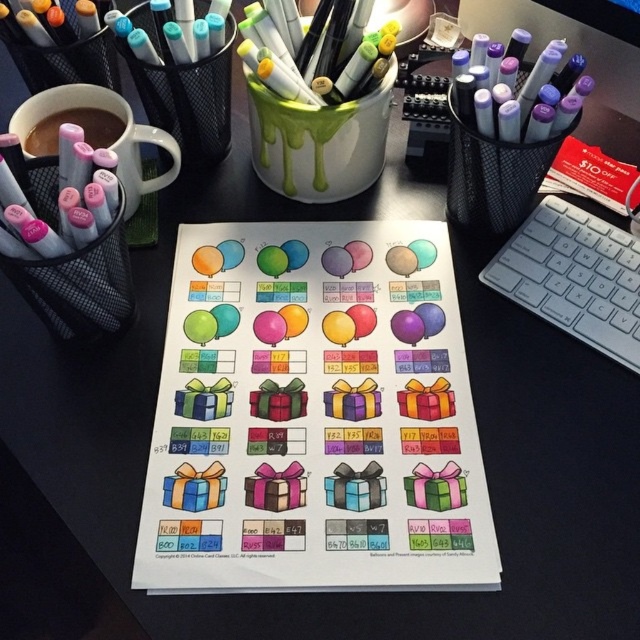
Question: Which object is the farthest from the purple matte marker at upper right?

Choices:
 (A) brown matte mug at upper left
 (B) white plastic keyboard at right
 (C) matte white mug at upper left

Answer: (A)

Question: Can you confirm if white plastic keyboard at right is positioned to the left of matte white mug at upper left?

Choices:
 (A) no
 (B) yes

Answer: (A)

Question: From the image, what is the correct spatial relationship of white plastic keyboard at right in relation to matte white mug at upper left?

Choices:
 (A) below
 (B) above

Answer: (A)

Question: Which object is closer to the camera taking this photo?

Choices:
 (A) brown matte mug at upper left
 (B) white plastic keyboard at right

Answer: (B)

Question: Among these objects, which one is farthest from the camera?

Choices:
 (A) brown matte mug at upper left
 (B) matte white mug at upper left
 (C) purple matte marker at upper right

Answer: (A)

Question: Does white plastic keyboard at right appear over brown matte mug at upper left?

Choices:
 (A) yes
 (B) no

Answer: (B)